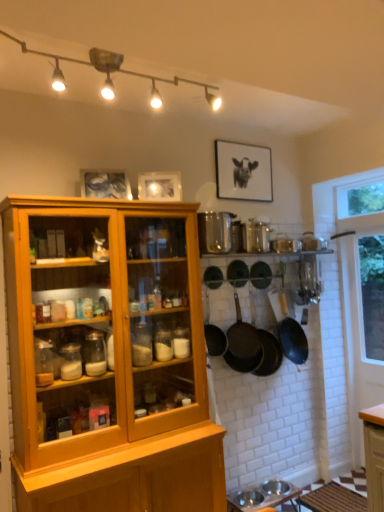
Question: Is metallic silver bowls at lower center, the second table viewed from the right, positioned beyond the bounds of dark brown textured frying pan at center, the 4th frying pan positioned from the left?

Choices:
 (A) yes
 (B) no

Answer: (A)

Question: From the image's perspective, would you say metallic silver bowls at lower center, the second table viewed from the right, is shown under dark brown textured frying pan at center, the 4th frying pan positioned from the left?

Choices:
 (A) yes
 (B) no

Answer: (A)

Question: Is metallic silver bowls at lower center, which is the 1th table from left to right, surrounding dark brown textured frying pan at center, the 4th frying pan positioned from the left?

Choices:
 (A) yes
 (B) no

Answer: (B)

Question: Can you confirm if metallic silver bowls at lower center, which is the 1th table from left to right, is wider than dark brown textured frying pan at center, the 3th frying pan when ordered from right to left?

Choices:
 (A) yes
 (B) no

Answer: (A)

Question: From the image's perspective, is metallic silver bowls at lower center, the second table viewed from the right, above dark brown textured frying pan at center, the 3th frying pan when ordered from right to left?

Choices:
 (A) no
 (B) yes

Answer: (A)

Question: Is black matte frying pan at center, marked as the 5th frying pan in a right-to-left arrangement, to the left or to the right of green matte frying pan at center, the 2th frying pan positioned from the right, in the image?

Choices:
 (A) right
 (B) left

Answer: (B)

Question: Does point (253, 328) appear closer or farther from the camera than point (251, 265)?

Choices:
 (A) farther
 (B) closer

Answer: (B)

Question: Looking at the image, does black matte frying pan at center, marked as the 2th frying pan in a left-to-right arrangement, seem bigger or smaller compared to green matte frying pan at center, the 2th frying pan positioned from the right?

Choices:
 (A) small
 (B) big

Answer: (B)

Question: From a real-world perspective, is black matte frying pan at center, marked as the 5th frying pan in a right-to-left arrangement, above or below green matte frying pan at center, the 2th frying pan positioned from the right?

Choices:
 (A) above
 (B) below

Answer: (B)

Question: Is black matte frying pan at center-right, acting as the sixth frying pan starting from the left, bigger or smaller than dark brown textured frying pan at center, the 4th frying pan positioned from the left?

Choices:
 (A) small
 (B) big

Answer: (B)

Question: From a real-world perspective, is black matte frying pan at center-right, arranged as the 1th frying pan when viewed from the right, above or below dark brown textured frying pan at center, the 3th frying pan when ordered from right to left?

Choices:
 (A) above
 (B) below

Answer: (B)

Question: From the image's perspective, is black matte frying pan at center-right, arranged as the 1th frying pan when viewed from the right, above or below dark brown textured frying pan at center, the 4th frying pan positioned from the left?

Choices:
 (A) below
 (B) above

Answer: (B)

Question: In the image, is black matte frying pan at center-right, acting as the sixth frying pan starting from the left, positioned in front of or behind dark brown textured frying pan at center, the 4th frying pan positioned from the left?

Choices:
 (A) behind
 (B) front

Answer: (A)

Question: Based on their sizes in the image, would you say black matte picture frame at upper center, the first picture frame in the back-to-front sequence, is bigger or smaller than white glass window at right?

Choices:
 (A) big
 (B) small

Answer: (B)

Question: Looking at their shapes, would you say black matte picture frame at upper center, which is counted as the 1th picture frame, starting from the right, is wider or thinner than white glass window at right?

Choices:
 (A) wide
 (B) thin

Answer: (B)